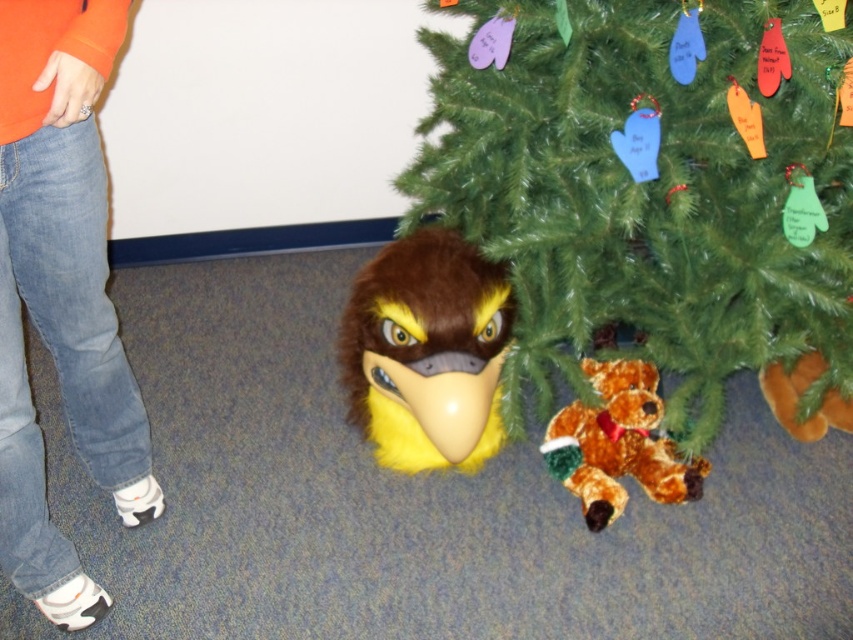
Between fluffy yellow bird at center and brown plush bear at lower center, which one appears on the left side from the viewer's perspective?

From the viewer's perspective, fluffy yellow bird at center appears more on the left side.

I want to click on fluffy yellow bird at center, so click(x=426, y=352).

Can you confirm if green matte christmas tree at center is positioned above brown plush bear at lower center?

Yes, green matte christmas tree at center is above brown plush bear at lower center.

Between green matte christmas tree at center and brown plush bear at lower center, which one is positioned higher?

Positioned higher is green matte christmas tree at center.

Which is in front, point (524, 104) or point (544, 429)?

Point (524, 104)

Find the location of a particular element. This screenshot has height=640, width=853. green matte christmas tree at center is located at coordinates (654, 188).

Describe the element at coordinates (654, 188) in the screenshot. I see `green matte christmas tree at center` at that location.

Locate an element on the screen. The image size is (853, 640). green matte christmas tree at center is located at coordinates (654, 188).

Where is `green matte christmas tree at center`? The width and height of the screenshot is (853, 640). green matte christmas tree at center is located at coordinates (654, 188).